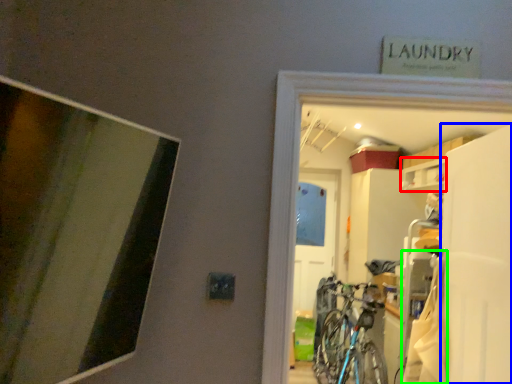
Question: Which object is the farthest from cabinet (highlighted by a red box)? Choose among these: screen door (highlighted by a blue box) or laundry (highlighted by a green box).

Choices:
 (A) screen door
 (B) laundry

Answer: (B)